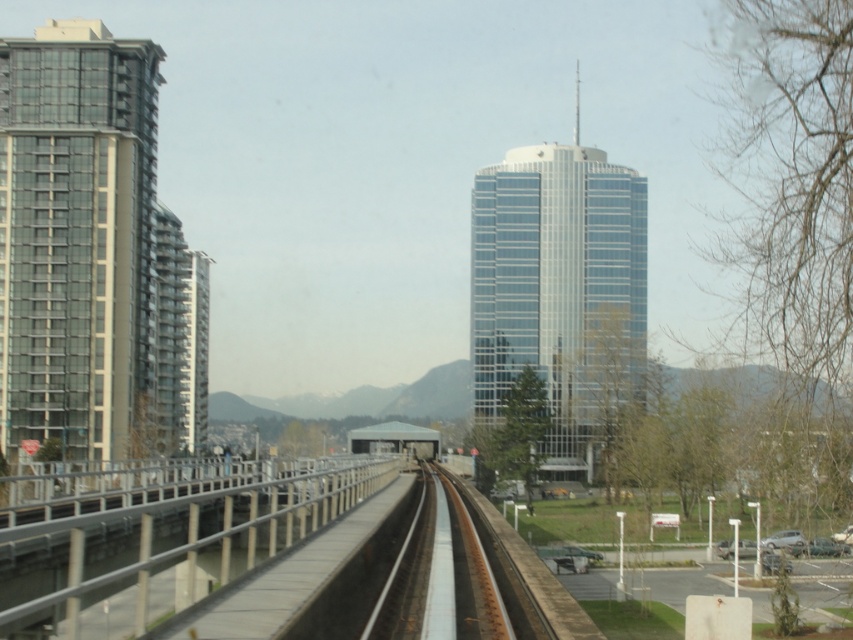
You are a drone operator trying to navigate between the glassy blue skyscraper at center and the smooth steel tracks at center. Which object is closer to your current position?

The glassy blue skyscraper at center is closer to you than the smooth steel tracks at center because it is further to the viewer.

You are a city planner analyzing the urban layout. Given the glassy concrete building at left and the smooth steel tracks at center, which object occupies a larger area in the scene?

The glassy concrete building at left is bigger than the smooth steel tracks at center, so it occupies a larger area in the scene.

You are a delivery drone flying towards the glassy concrete building at left and the white metal rail at center. Which object will you reach first?

The glassy concrete building at left will be reached first because it is closer to the drone than the white metal rail at center, which is further away.